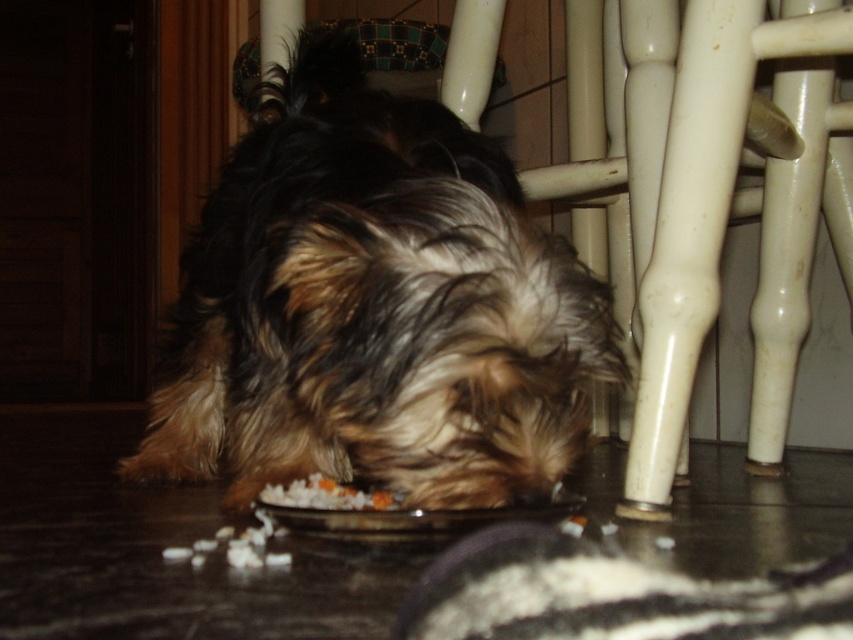
Question: Which of the following is the farthest from the observer?

Choices:
 (A) shaggy brown fur at center
 (B) white crumbly food at lower center

Answer: (B)

Question: Does shaggy brown fur at center appear on the right side of white crumbly food at lower center?

Choices:
 (A) no
 (B) yes

Answer: (B)

Question: Does shaggy brown fur at center appear under white crumbly food at lower center?

Choices:
 (A) no
 (B) yes

Answer: (A)

Question: Which point is closer to the camera?

Choices:
 (A) (236, 292)
 (B) (276, 504)

Answer: (B)

Question: Is shaggy brown fur at center in front of white crumbly food at lower center?

Choices:
 (A) no
 (B) yes

Answer: (B)